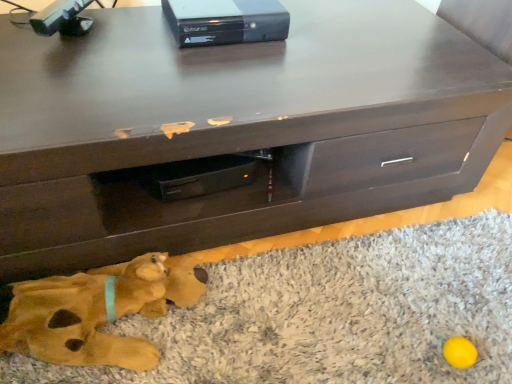
Locate an element on the screen. This screenshot has width=512, height=384. vacant space situated on the left part of black plastic game console at upper center is located at coordinates (132, 30).